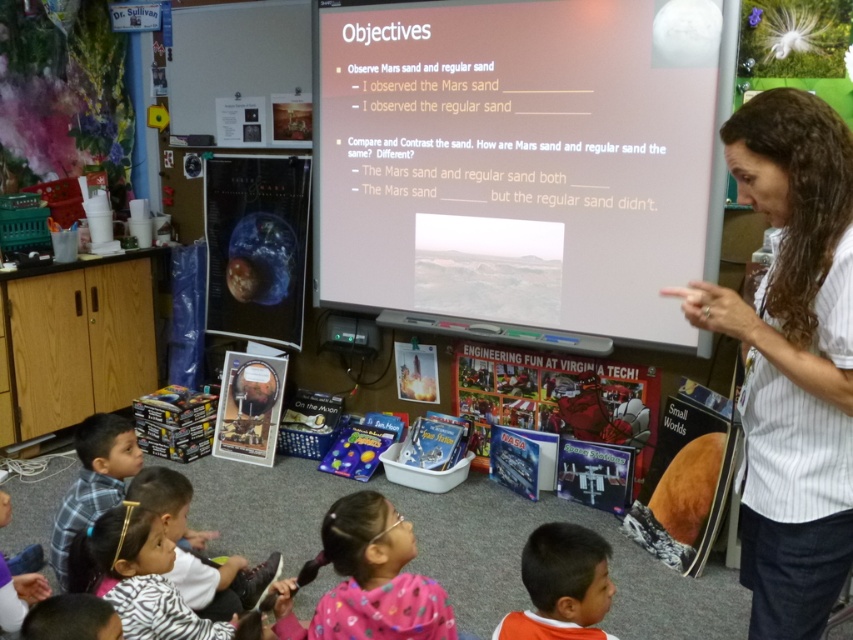
Can you confirm if brown hair at upper right is positioned to the right of orange fabric shirt at lower center?

Correct, you'll find brown hair at upper right to the right of orange fabric shirt at lower center.

Can you confirm if brown hair at upper right is thinner than orange fabric shirt at lower center?

Incorrect, brown hair at upper right's width is not less than orange fabric shirt at lower center's.

Is point (749, 557) in front of point (569, 620)?

No, it is behind (569, 620).

At what (x,y) coordinates should I click in order to perform the action: click on brown hair at upper right. Please return your answer as a coordinate pair (x, y). The image size is (853, 640). Looking at the image, I should click on (791, 358).

This screenshot has width=853, height=640. I want to click on brown hair at upper right, so click(791, 358).

Who is lower down, brown hair at upper right or zebra print sweater at lower left?

zebra print sweater at lower left is lower down.

Locate an element on the screen. The height and width of the screenshot is (640, 853). brown hair at upper right is located at coordinates click(791, 358).

At what (x,y) coordinates should I click in order to perform the action: click on brown hair at upper right. Please return your answer as a coordinate pair (x, y). Looking at the image, I should click on (791, 358).

Who is more distant from viewer, (x=160, y=625) or (x=598, y=538)?

Positioned behind is point (x=160, y=625).

Which is above, zebra print sweater at lower left or orange fabric shirt at lower center?

orange fabric shirt at lower center is above.

The width and height of the screenshot is (853, 640). What are the coordinates of `zebra print sweater at lower left` in the screenshot? It's located at (138, 577).